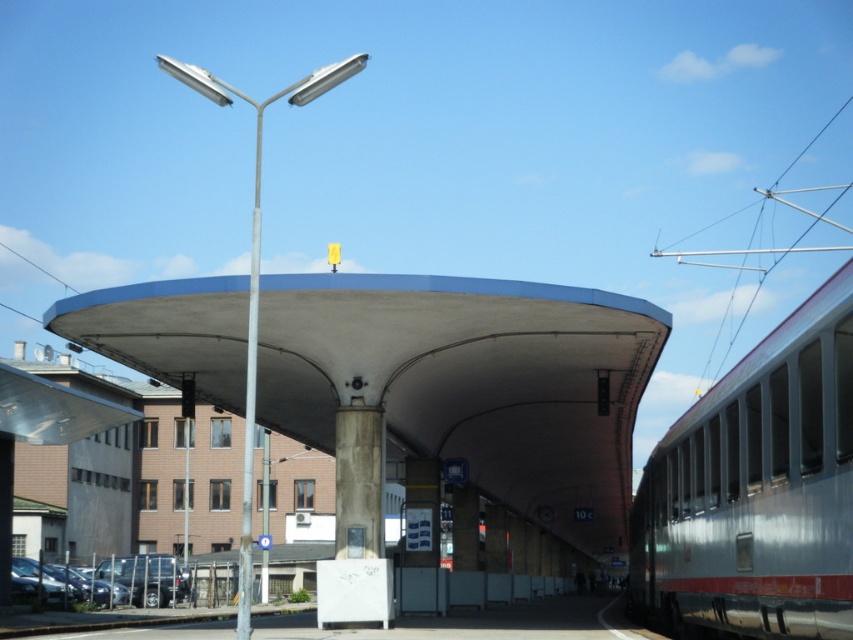
Question: Estimate the real-world distances between objects in this image. Which object is closer to the concrete/smooth canopy at center?

Choices:
 (A) silver metallic train at right
 (B) metallic pole at left

Answer: (A)

Question: Which is farther from the silver metallic train at right?

Choices:
 (A) metallic pole at left
 (B) concrete/smooth canopy at center

Answer: (A)

Question: Which point appears farthest from the camera in this image?

Choices:
 (A) (633, 541)
 (B) (178, 374)

Answer: (A)

Question: Is concrete/smooth canopy at center wider than metallic pole at left?

Choices:
 (A) no
 (B) yes

Answer: (A)

Question: From the image, what is the correct spatial relationship of concrete/smooth canopy at center in relation to silver metallic train at right?

Choices:
 (A) right
 (B) left

Answer: (B)

Question: Is concrete/smooth canopy at center wider than silver metallic train at right?

Choices:
 (A) yes
 (B) no

Answer: (A)